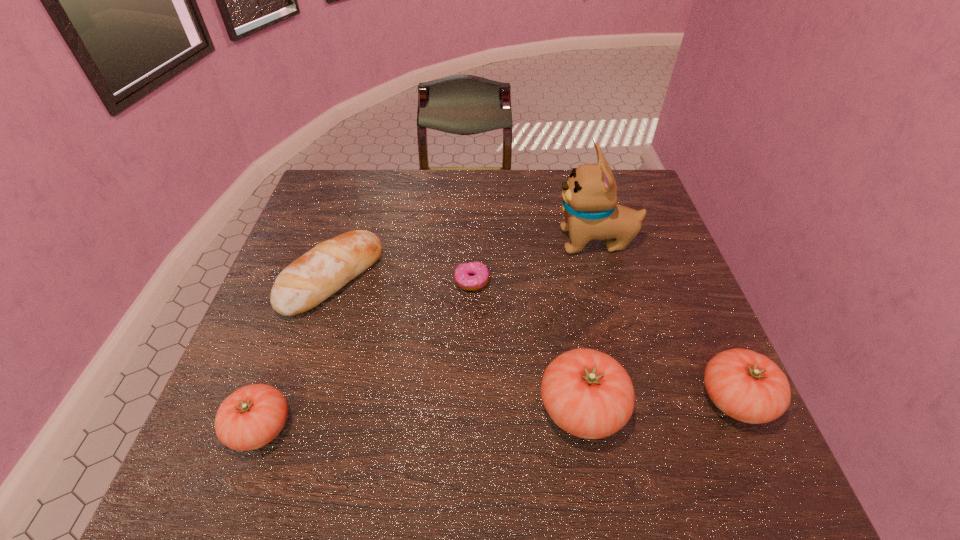
Image resolution: width=960 pixels, height=540 pixels. Find the location of `tomato that stands as the second closest to the rightmost object`. tomato that stands as the second closest to the rightmost object is located at coordinates (252, 416).

Where is `blank space that satisfies the following two spatial constraints: 1. on the back side of the rightmost tomato; 2. on the left side of the second tomato from left to right`? This screenshot has width=960, height=540. blank space that satisfies the following two spatial constraints: 1. on the back side of the rightmost tomato; 2. on the left side of the second tomato from left to right is located at coordinates (580, 399).

The image size is (960, 540). I want to click on free location that satisfies the following two spatial constraints: 1. on the face of the puppy; 2. on the front side of the bread, so click(x=606, y=279).

Find the location of a particular element. blank space that satisfies the following two spatial constraints: 1. on the back side of the bread; 2. on the left side of the shortest tomato is located at coordinates (314, 279).